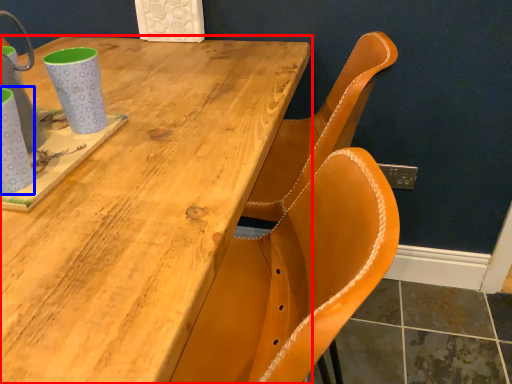
Question: Which of the following is the farthest to the observer, table (highlighted by a red box) or mug (highlighted by a blue box)?

Choices:
 (A) table
 (B) mug

Answer: (B)